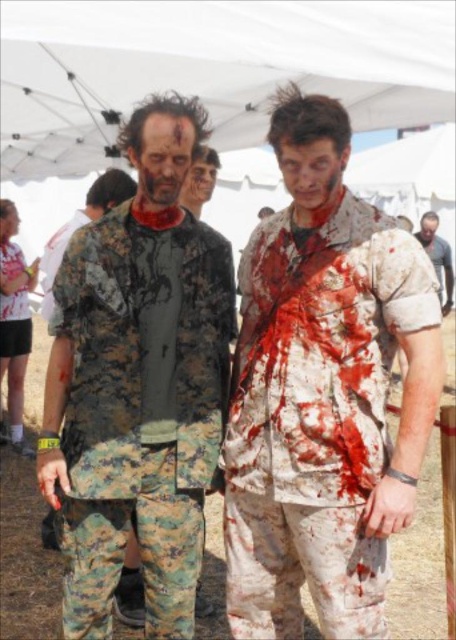
Question: Is camouflage fabric shirt at left bigger than camouflage pants at center?

Choices:
 (A) yes
 (B) no

Answer: (B)

Question: Does blood-stained fabric shirt at center lie in front of camouflage pants at center?

Choices:
 (A) yes
 (B) no

Answer: (A)

Question: Which object is the farthest from the camouflage pants at center?

Choices:
 (A) blood-stained fabric shirt at center
 (B) camouflage fabric shirt at center

Answer: (A)

Question: Which is nearer to the camouflage fabric shirt at left?

Choices:
 (A) blood-stained fabric shirt at center
 (B) camouflage pants at center

Answer: (A)

Question: Which point is farther to the camera?

Choices:
 (A) camouflage fabric shirt at left
 (B) camouflage fabric shirt at center
 (C) blood-stained fabric shirt at center

Answer: (B)

Question: Can you confirm if blood-stained fabric shirt at center is wider than camouflage pants at center?

Choices:
 (A) no
 (B) yes

Answer: (A)